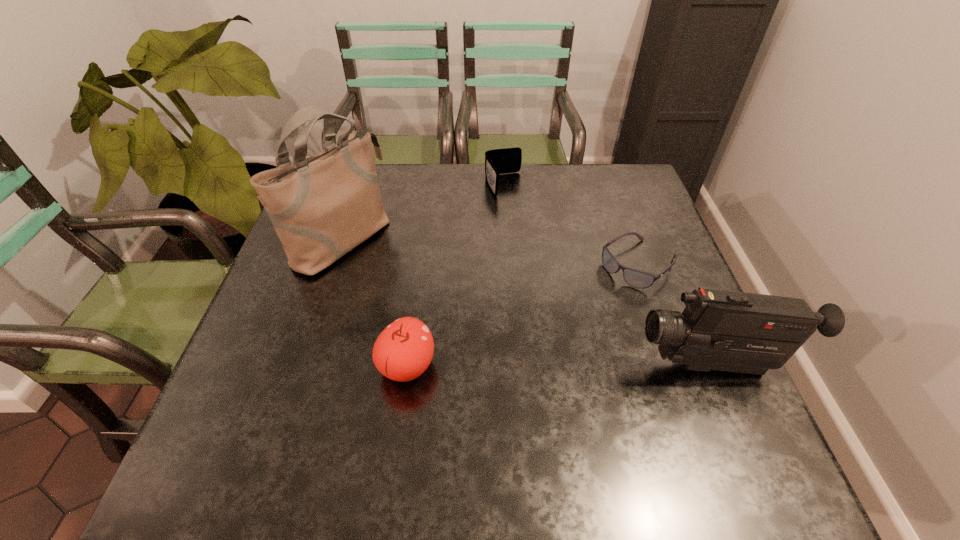
Find the location of `apple`. apple is located at coordinates (404, 349).

Identify the location of the fourth object from right to left. This screenshot has width=960, height=540. (404, 349).

Where is `the second tallest object`? the second tallest object is located at coordinates (722, 330).

The width and height of the screenshot is (960, 540). What are the coordinates of `the tallest object` in the screenshot? It's located at (323, 206).

At what (x,y) coordinates should I click in order to perform the action: click on the leftmost object. Please return your answer as a coordinate pair (x, y). Looking at the image, I should click on (323, 206).

Find the location of a particular element. the third object from left to right is located at coordinates (498, 161).

Locate an element on the screen. The height and width of the screenshot is (540, 960). the farthest object is located at coordinates (498, 161).

What are the coordinates of `the shortest object` in the screenshot? It's located at (637, 279).

Where is `free region located on the right of the fourth object from right to left`? The image size is (960, 540). free region located on the right of the fourth object from right to left is located at coordinates (504, 366).

The height and width of the screenshot is (540, 960). I want to click on vacant space located on the front-facing side of the camcorder, so click(503, 366).